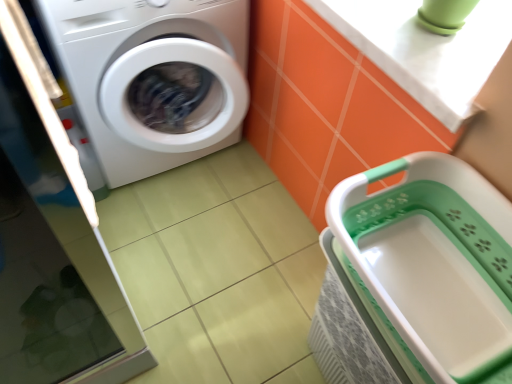
Question: Does white plastic basket at lower right appear on the right side of white glossy counter top at upper right?

Choices:
 (A) yes
 (B) no

Answer: (B)

Question: Considering the relative sizes of white plastic basket at lower right and white glossy counter top at upper right in the image provided, is white plastic basket at lower right bigger than white glossy counter top at upper right?

Choices:
 (A) yes
 (B) no

Answer: (A)

Question: Is white plastic basket at lower right positioned far away from white glossy counter top at upper right?

Choices:
 (A) no
 (B) yes

Answer: (A)

Question: Considering the relative positions of white plastic basket at lower right and white glossy counter top at upper right in the image provided, is white plastic basket at lower right in front of white glossy counter top at upper right?

Choices:
 (A) yes
 (B) no

Answer: (A)

Question: Is white plastic basket at lower right aimed at white glossy counter top at upper right?

Choices:
 (A) no
 (B) yes

Answer: (A)

Question: Can you confirm if white plastic basket at lower right is taller than white glossy counter top at upper right?

Choices:
 (A) yes
 (B) no

Answer: (A)

Question: Is white glossy counter top at upper right positioned far away from white plastic basket at lower right?

Choices:
 (A) no
 (B) yes

Answer: (A)

Question: From the image's perspective, would you say white glossy counter top at upper right is positioned over white plastic basket at lower right?

Choices:
 (A) yes
 (B) no

Answer: (A)

Question: Does white glossy counter top at upper right appear on the right side of white plastic basket at lower right?

Choices:
 (A) yes
 (B) no

Answer: (A)

Question: From the image's perspective, is white glossy counter top at upper right under white plastic basket at lower right?

Choices:
 (A) yes
 (B) no

Answer: (B)

Question: Is white plastic basket at lower right surrounded by white glossy counter top at upper right?

Choices:
 (A) yes
 (B) no

Answer: (B)

Question: Is white glossy counter top at upper right turned away from white plastic basket at lower right?

Choices:
 (A) no
 (B) yes

Answer: (A)

Question: Is white glossy washing machine at left completely or partially outside of white glossy counter top at upper right?

Choices:
 (A) no
 (B) yes

Answer: (B)